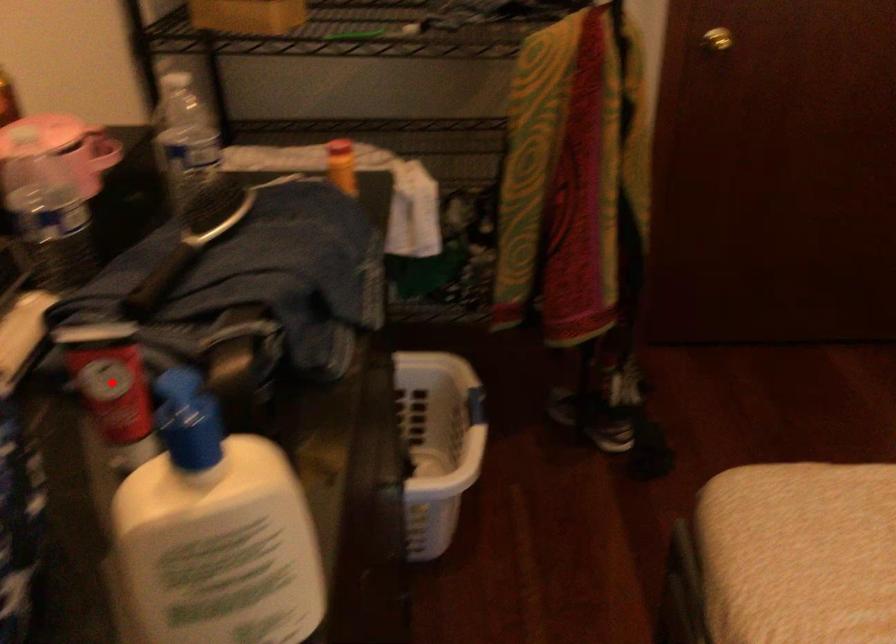
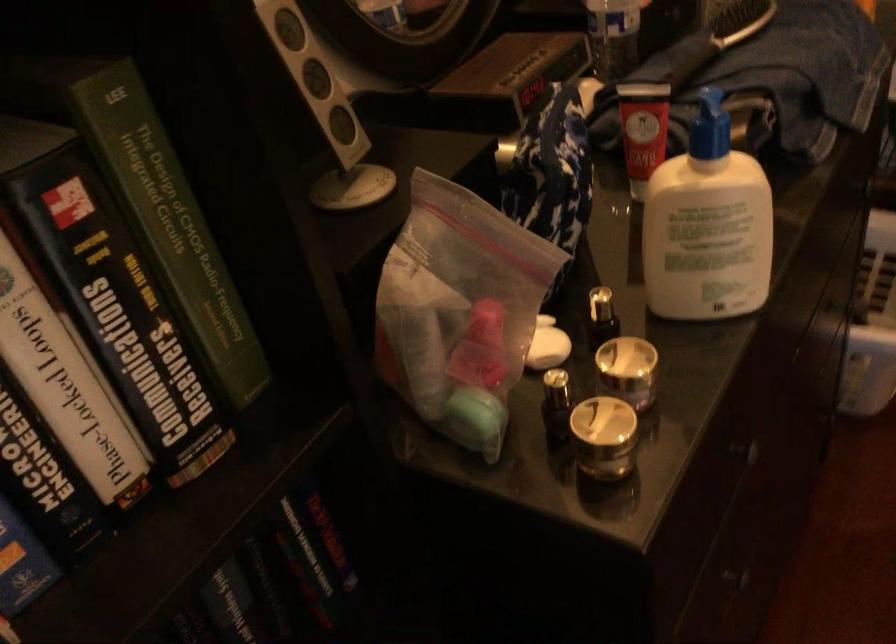
Question: I am providing you with two images of the same scene from different viewpoints. Image1 has a red point marked. In image2, the corresponding 3D location appears at what relative position? Reply with the corresponding letter.

Choices:
 (A) Closer
 (B) Farther

Answer: (B)